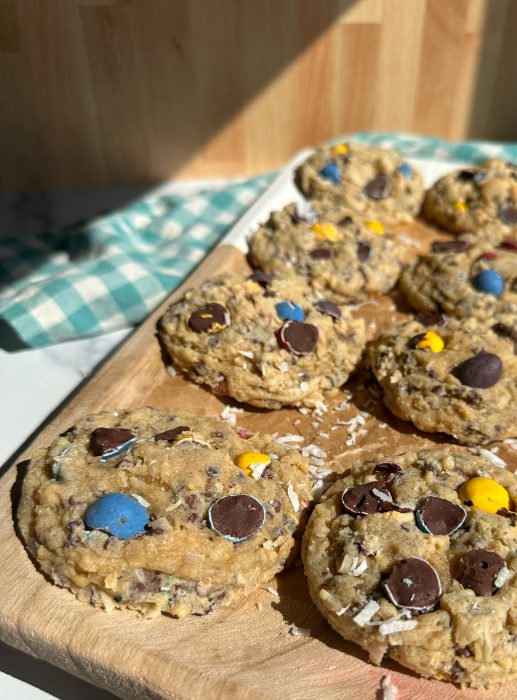
Find the location of `wooden tray`. wooden tray is located at coordinates (260, 657).